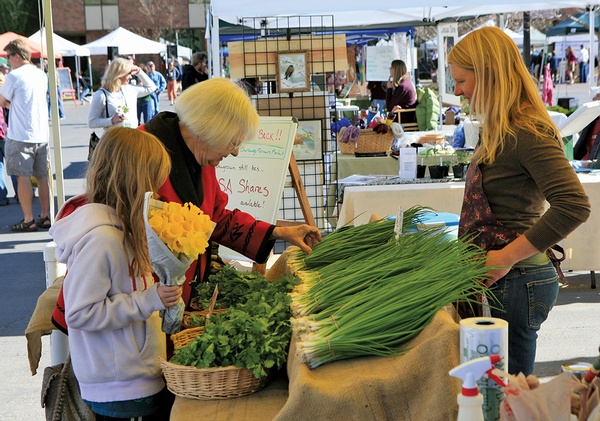
Identify the location of spray bottle. (468, 387).